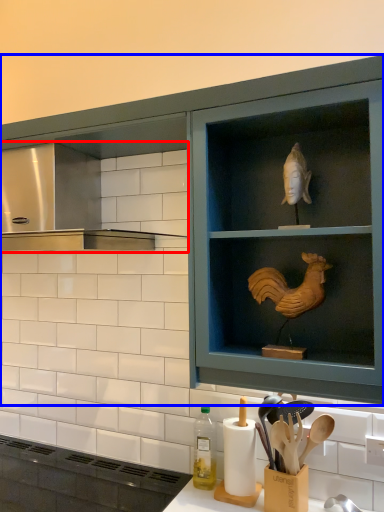
Question: Which of the following is the closest to the observer, vent (highlighted by a red box) or cabinetry (highlighted by a blue box)?

Choices:
 (A) vent
 (B) cabinetry

Answer: (A)